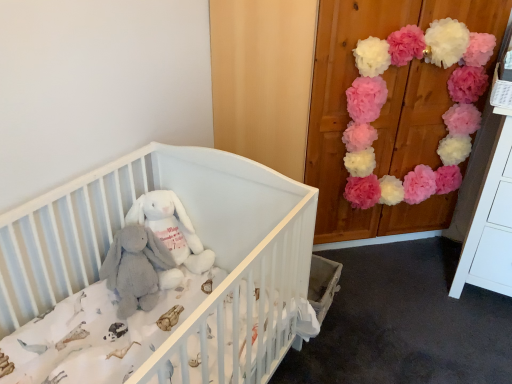
Question: In the image, is pink tissue paper pom-poms at upper right on the left side or the right side of gray plush elephant at center?

Choices:
 (A) right
 (B) left

Answer: (A)

Question: From the image's perspective, is pink tissue paper pom-poms at upper right located above or below gray plush elephant at center?

Choices:
 (A) below
 (B) above

Answer: (B)

Question: Estimate the real-world distances between objects in this image. Which object is closer to the white plush rabbit at center?

Choices:
 (A) pink tissue paper pom-poms at upper right
 (B) gray plush elephant at center
 (C) white soft crib at center

Answer: (B)

Question: Based on their relative distances, which object is nearer to the white soft crib at center?

Choices:
 (A) gray plush elephant at center
 (B) white plush rabbit at center
 (C) pink tissue paper pom-poms at upper right

Answer: (B)